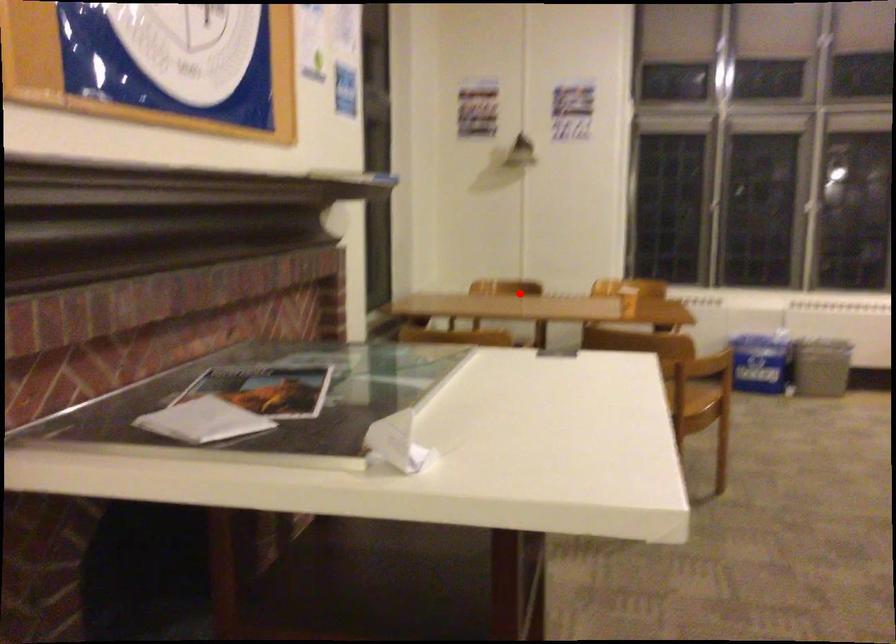
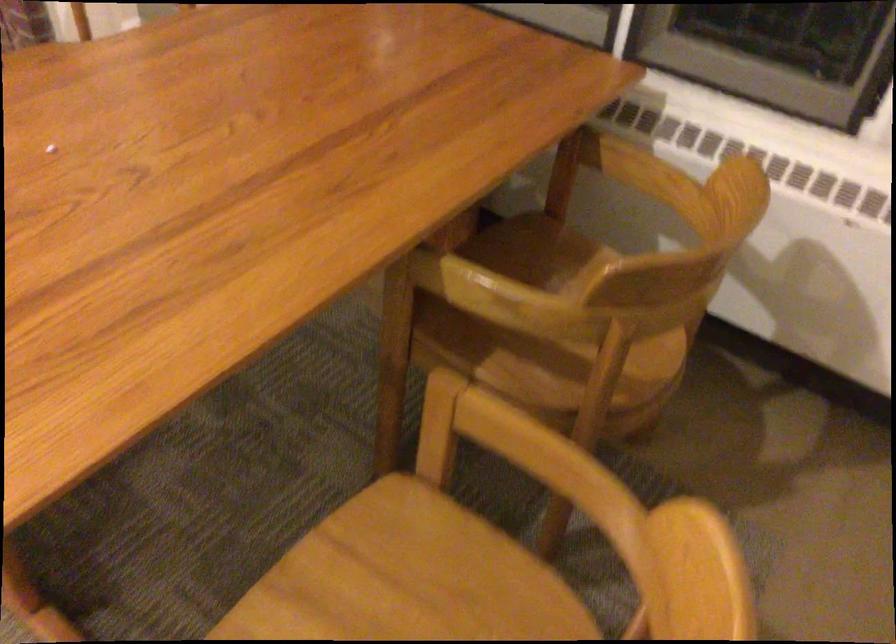
Question: I am providing you with two images of the same scene from different viewpoints. In image1, a red point is highlighted. Considering the same 3D point in image2, which of the following is correct?

Choices:
 (A) It is closer
 (B) It is farther

Answer: (A)